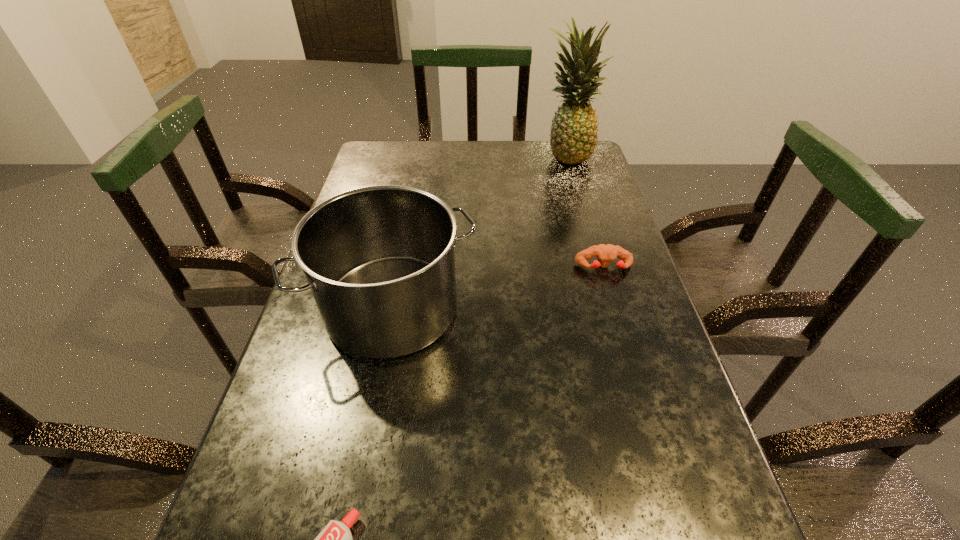
Where is `puncher located in the right edge section of the desktop`? Image resolution: width=960 pixels, height=540 pixels. puncher located in the right edge section of the desktop is located at coordinates (605, 253).

This screenshot has width=960, height=540. Find the location of `object present at the far right corner`. object present at the far right corner is located at coordinates (573, 137).

In the image, there is a desktop. At what (x,y) coordinates should I click in order to perform the action: click on vacant space at the far edge. Please return your answer as a coordinate pair (x, y). This screenshot has height=540, width=960. Looking at the image, I should click on (545, 176).

You are a GUI agent. You are given a task and a screenshot of the screen. Output one action in this format:
    pyautogui.click(x=<x>, y=<y>)
    Task: Click on the vacant space at the left edge
    
    Given the screenshot: What is the action you would take?
    pyautogui.click(x=405, y=184)

The height and width of the screenshot is (540, 960). In the image, there is a desktop. Find the location of `vacant space at the right edge`. vacant space at the right edge is located at coordinates (x=632, y=337).

In order to click on vacant point located between the puncher and the pineapple in this screenshot , I will do `click(586, 211)`.

Image resolution: width=960 pixels, height=540 pixels. Find the location of `vacant space that's between the third shortest object and the tallest object`. vacant space that's between the third shortest object and the tallest object is located at coordinates (479, 232).

You are a GUI agent. You are given a task and a screenshot of the screen. Output one action in this format:
    pyautogui.click(x=<x>, y=<y>)
    Task: Click on the unoccupied area between the tallest object and the third shortest object
    Image resolution: width=960 pixels, height=540 pixels.
    Given the screenshot: What is the action you would take?
    pyautogui.click(x=479, y=232)

This screenshot has width=960, height=540. In order to click on free space between the third tallest object and the third shortest object in this screenshot , I will do `click(498, 288)`.

The image size is (960, 540). In order to click on free space between the saucepan and the third tallest object in this screenshot , I will do `click(498, 288)`.